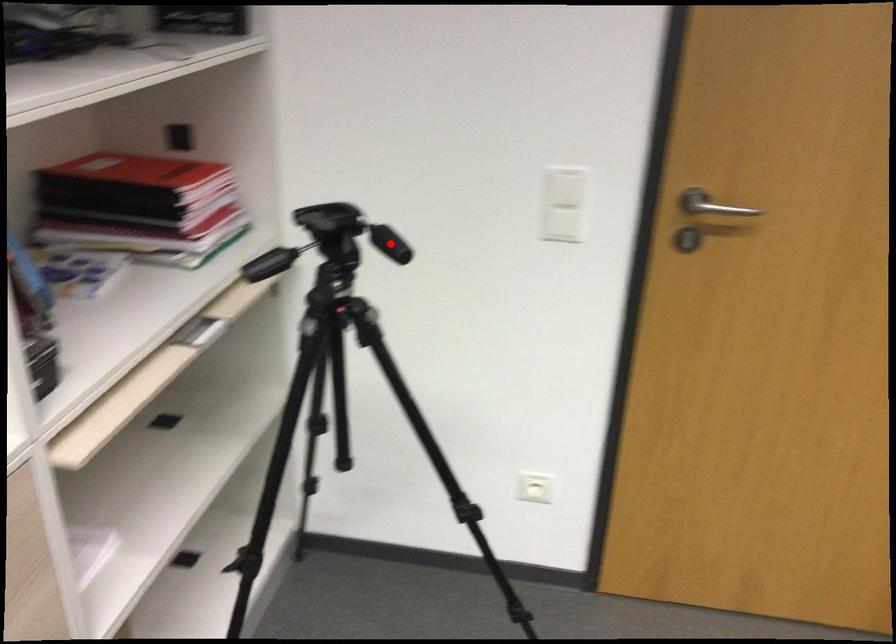
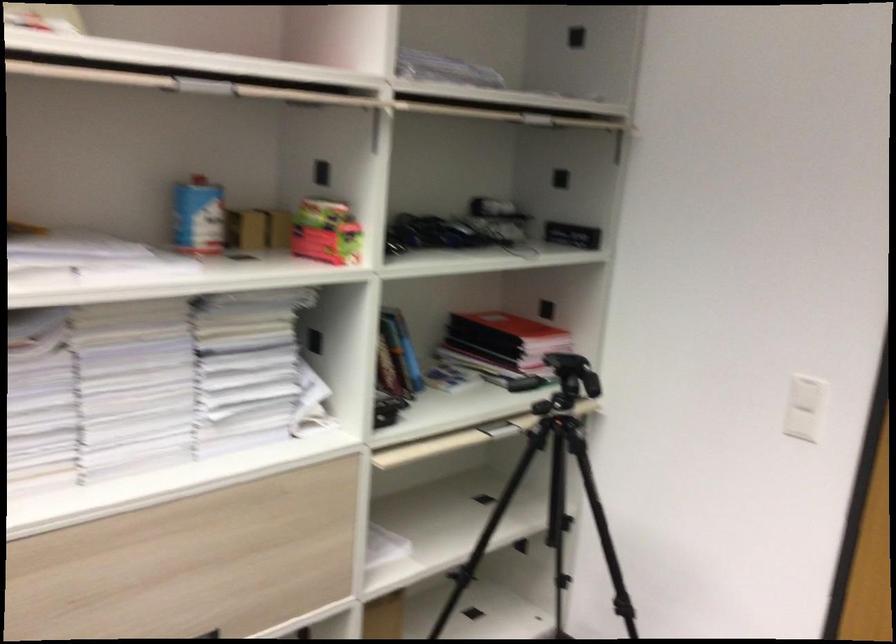
Question: I am providing you with two images of the same scene from different viewpoints. A red point is marked on the first image. Can you still see the location of the red point in image 2?

Choices:
 (A) Yes
 (B) No

Answer: (B)